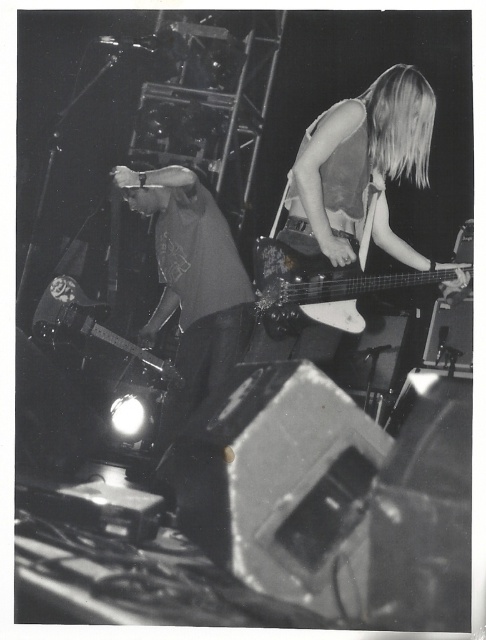
How much distance is there between glossy black guitar at center and shiny black electric guitar at left?

glossy black guitar at center and shiny black electric guitar at left are 38.54 inches apart.

Can you confirm if glossy black guitar at center is positioned to the right of shiny black electric guitar at left?

Correct, you'll find glossy black guitar at center to the right of shiny black electric guitar at left.

Measure the distance between glossy black guitar at center and camera.

glossy black guitar at center and camera are 7.76 feet apart.

At what (x,y) coordinates should I click in order to perform the action: click on glossy black guitar at center. Please return your answer as a coordinate pair (x, y). The height and width of the screenshot is (640, 486). Looking at the image, I should click on (318, 289).

Between dark gray fabric shirt at center and glossy black guitar at center, which one is positioned lower?

Positioned lower is dark gray fabric shirt at center.

Is point (173, 301) more distant than point (343, 310)?

Yes.

Locate an element on the screen. dark gray fabric shirt at center is located at coordinates (191, 280).

Is shiny silver guitar at upper right positioned at the back of shiny black electric guitar at left?

No, it is not.

Is point (318, 220) more distant than point (105, 342)?

That is False.

Find the location of `shiny silver guitar at upper right`. shiny silver guitar at upper right is located at coordinates [x=362, y=170].